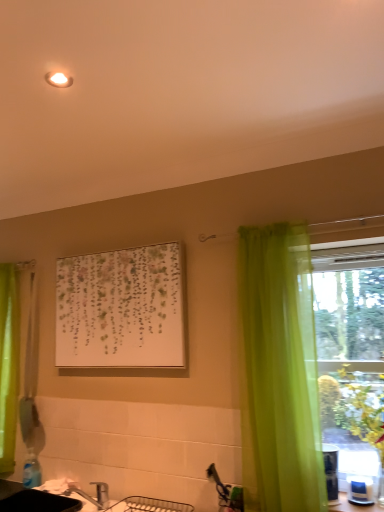
The height and width of the screenshot is (512, 384). In order to click on free space above white matte picture frame at center (from a real-world perspective) in this screenshot , I will do [x=128, y=245].